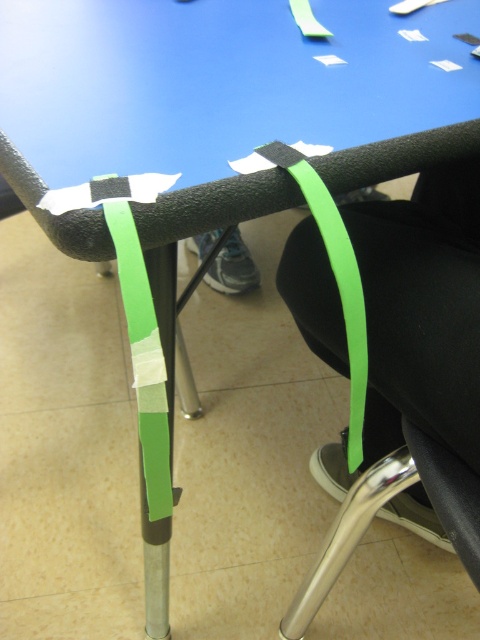
Is green matte strip at center closer to the viewer compared to green matte ribbon at center?

No, it is not.

Who is positioned more to the left, green matte strip at center or green matte ribbon at center?

green matte ribbon at center

Locate an element on the screen. This screenshot has height=640, width=480. green matte strip at center is located at coordinates (389, 358).

Does green matte strip at center have a greater width compared to green matte tape at center?

Correct, the width of green matte strip at center exceeds that of green matte tape at center.

Which is more to the left, green matte strip at center or green matte tape at center?

Positioned to the left is green matte tape at center.

You are a GUI agent. You are given a task and a screenshot of the screen. Output one action in this format:
    pyautogui.click(x=<x>, y=<y>)
    Task: Click on the green matte strip at center
    
    Given the screenshot: What is the action you would take?
    pyautogui.click(x=389, y=358)

Between green matte tape at center and green matte ribbon at center, which one has less height?

green matte tape at center is shorter.

Looking at this image, between green matte tape at center and green matte ribbon at center, which one has more height?

green matte ribbon at center

The image size is (480, 640). In order to click on green matte tape at center in this screenshot , I will do click(x=144, y=358).